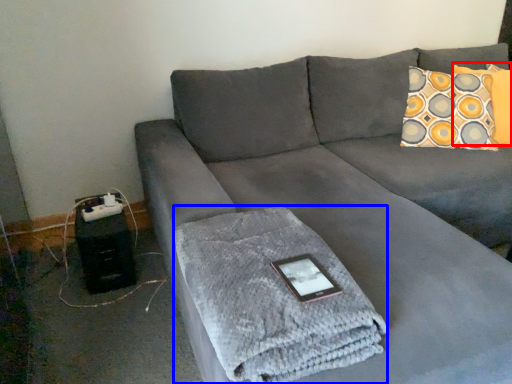
Question: Which object appears farthest to the camera in this image, pillow (highlighted by a red box) or bath towel (highlighted by a blue box)?

Choices:
 (A) pillow
 (B) bath towel

Answer: (A)